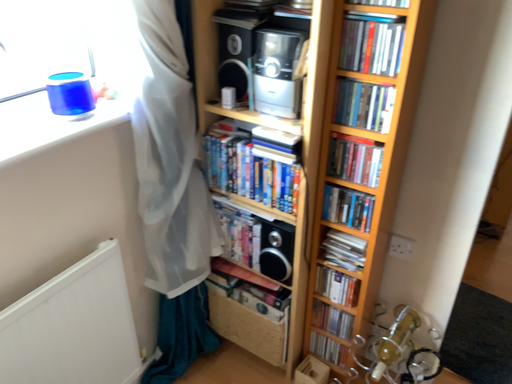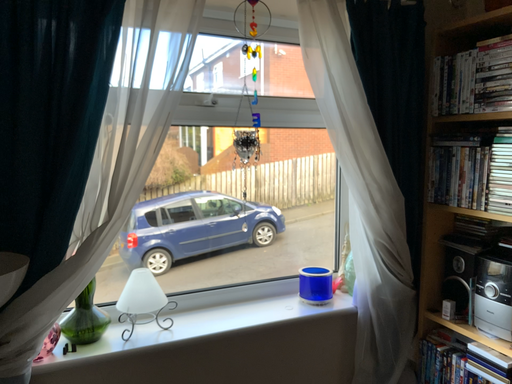
Question: How did the camera likely rotate when shooting the video?

Choices:
 (A) rotated downward
 (B) rotated upward

Answer: (B)